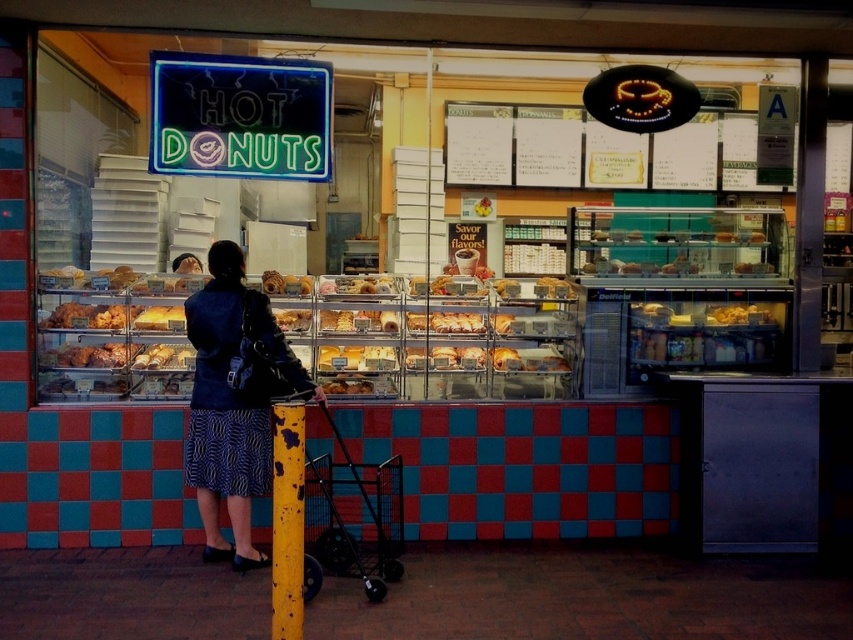
Question: Where is black metal baby carriage at lower center located in relation to yellow glazed pastry at center in the image?

Choices:
 (A) below
 (B) above

Answer: (A)

Question: Can you confirm if denim jacket at center is wider than yellow glazed pastry at center?

Choices:
 (A) yes
 (B) no

Answer: (A)

Question: Is black metal baby carriage at lower center positioned behind yellow painted metal pole at center?

Choices:
 (A) yes
 (B) no

Answer: (A)

Question: Which of the following is the farthest from the observer?

Choices:
 (A) (160, 317)
 (B) (287, 556)
 (C) (331, 461)
 (D) (256, 550)

Answer: (A)

Question: Which object is closer to the camera taking this photo?

Choices:
 (A) black metal baby carriage at lower center
 (B) yellow painted metal pole at center
 (C) denim jacket at center

Answer: (B)

Question: Which point is closer to the camera?

Choices:
 (A) (367, 465)
 (B) (180, 323)

Answer: (A)